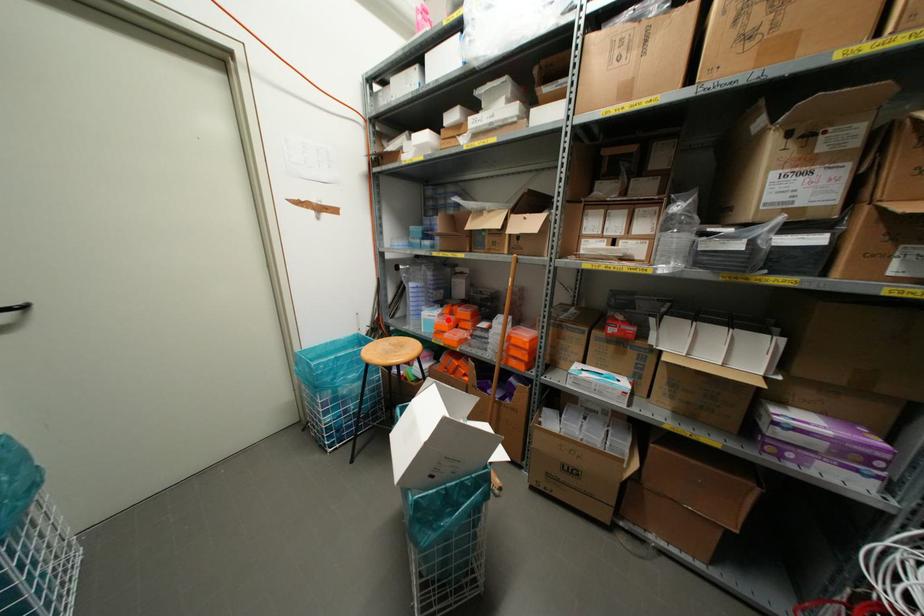
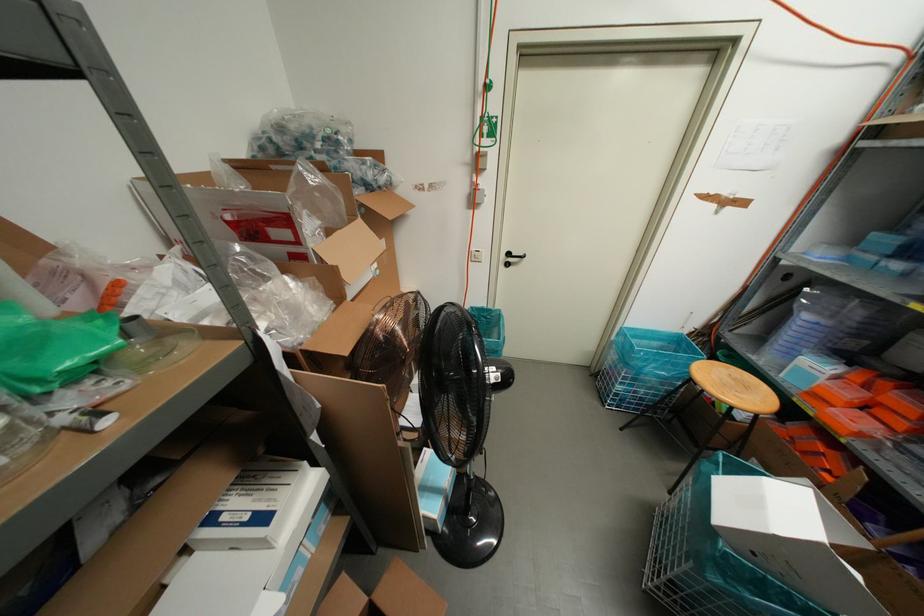
Locate, in the second image, the point that corresponds to the highlighted location in the first image.

(852, 394)